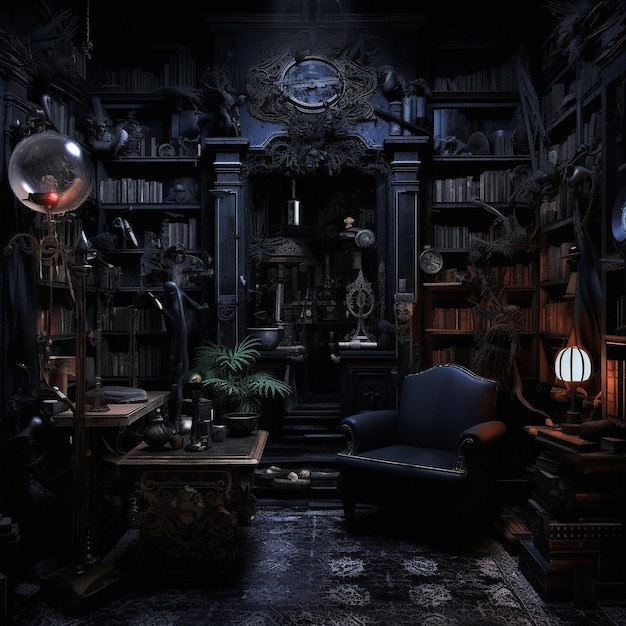
The height and width of the screenshot is (626, 626). What are the coordinates of `plant` in the screenshot? It's located at (239, 382).